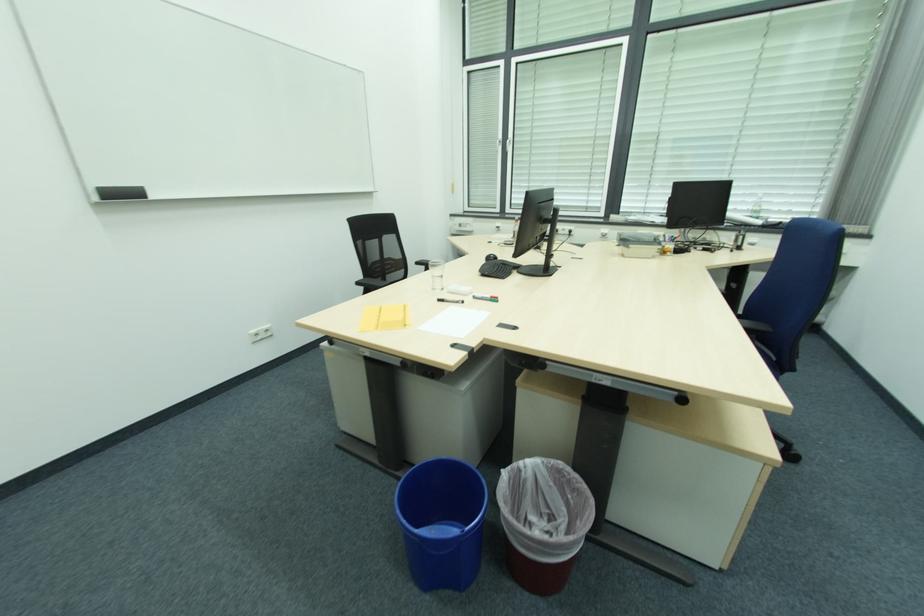
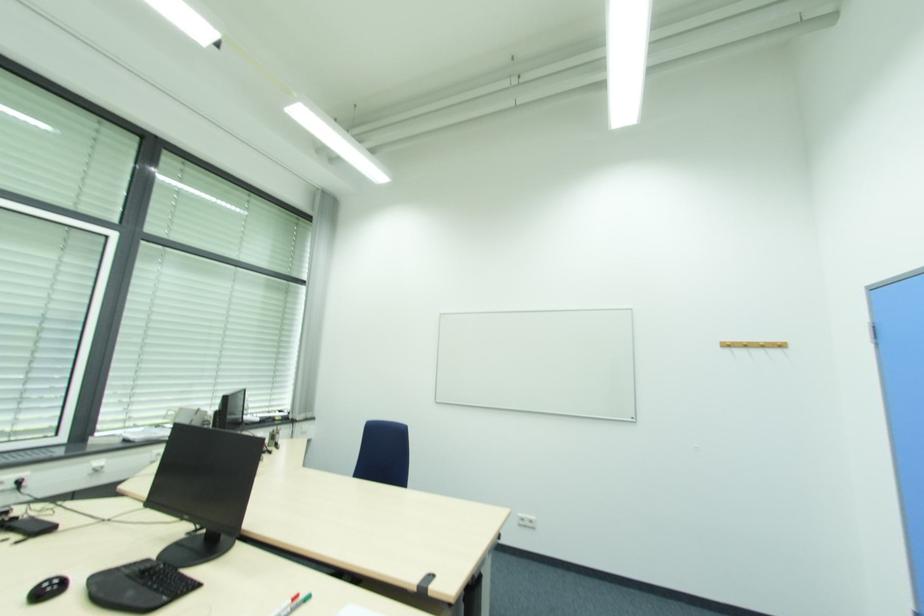
Where in the second image is the point corresponding to [494,257] from the first image?

(53, 586)